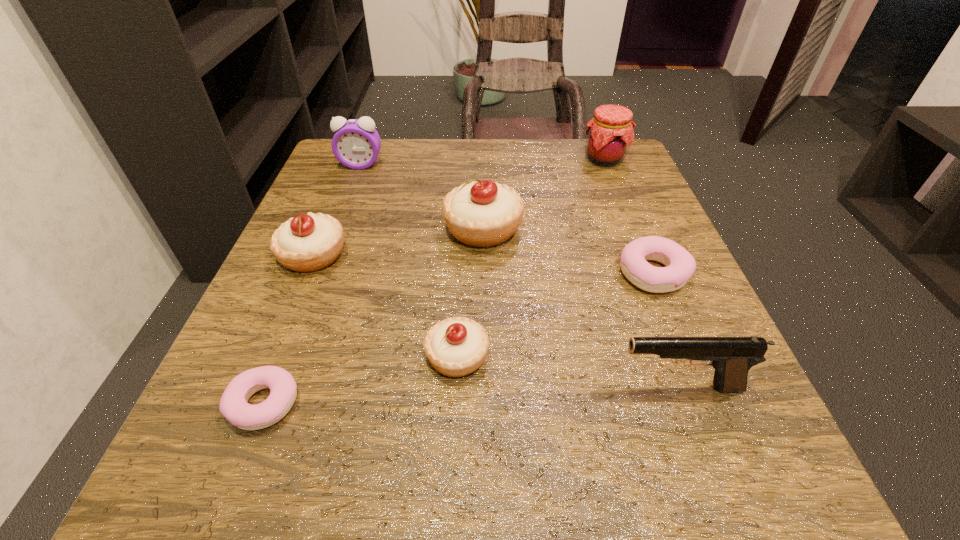
You are a GUI agent. You are given a task and a screenshot of the screen. Output one action in this format:
    pyautogui.click(x=<x>, y=<y>)
    Task: Click on the nearer pink pastry
    The image size is (960, 540).
    Given the screenshot: What is the action you would take?
    pyautogui.click(x=233, y=406)

In order to click on the left pink pastry in this screenshot , I will do `click(233, 406)`.

The image size is (960, 540). In order to click on vacant space located 0.390m on the front of the red jam in this screenshot , I will do `click(660, 299)`.

Image resolution: width=960 pixels, height=540 pixels. In order to click on vacant region located on the face of the alarm clock in this screenshot , I will do pyautogui.click(x=316, y=284).

What are the coordinates of `free region located 0.300m on the front of the tallest pastry` in the screenshot? It's located at (484, 409).

You are a GUI agent. You are given a task and a screenshot of the screen. Output one action in this format:
    pyautogui.click(x=<x>, y=<y>)
    Task: Click on the vacant space located at the muzzle of the pistol
    The image size is (960, 540).
    Given the screenshot: What is the action you would take?
    pyautogui.click(x=449, y=388)

You are a GUI agent. You are given a task and a screenshot of the screen. Output one action in this format:
    pyautogui.click(x=<x>, y=<y>)
    Task: Click on the free region located at the muzzle of the pistol
    This screenshot has width=960, height=540.
    Given the screenshot: What is the action you would take?
    pyautogui.click(x=442, y=388)

At what (x,y) coordinates should I click in order to perform the action: click on free spot located at the muzzle of the pistol. Please return your answer as a coordinate pair (x, y). This screenshot has height=540, width=960. Looking at the image, I should click on (419, 388).

The width and height of the screenshot is (960, 540). Find the location of `vacant area situated 0.190m on the right of the leftmost beige pastry`. vacant area situated 0.190m on the right of the leftmost beige pastry is located at coordinates (455, 255).

Where is `vacant space located 0.310m on the right of the third shortest object`? The width and height of the screenshot is (960, 540). vacant space located 0.310m on the right of the third shortest object is located at coordinates click(x=708, y=356).